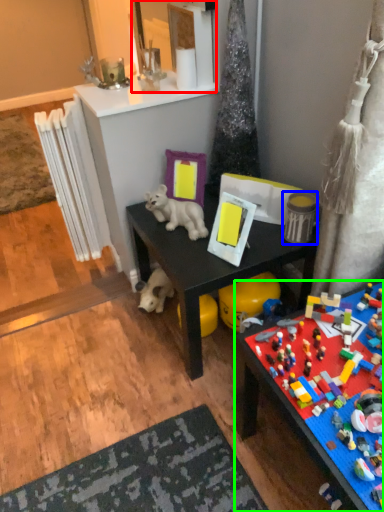
Question: Which object is the farthest from mirror (highlighted by a red box)? Choose among these: toy (highlighted by a blue box) or toy (highlighted by a green box).

Choices:
 (A) toy
 (B) toy

Answer: (B)